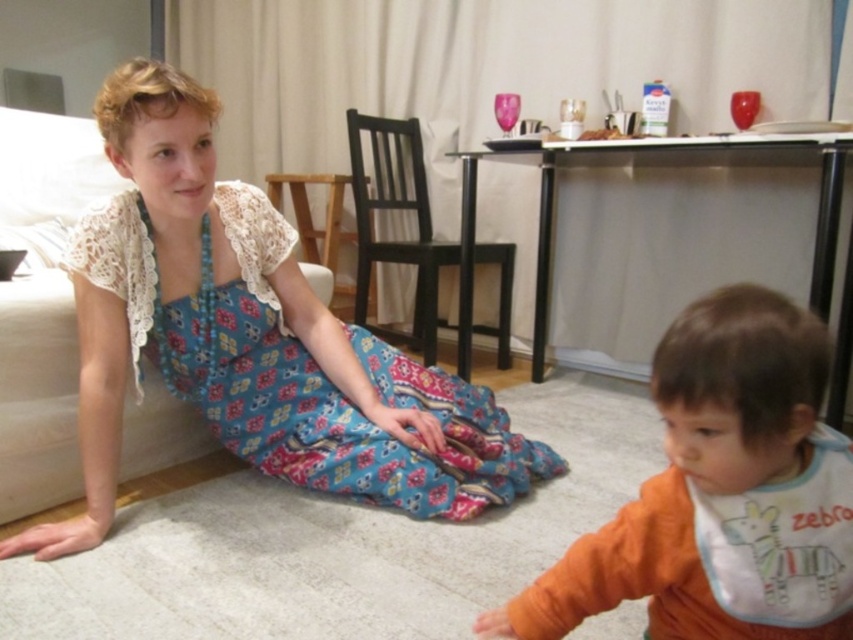
You are a tailor who needs to determine which item requires more fabric for alterations. Based on the scene, which item has a greater width between the blue printed fabric dress at lower left and the white fabric bib at lower right?

The blue printed fabric dress at lower left has a greater width than the white fabric bib at lower right, so it requires more fabric for alterations.

You are a parent preparing for a meal and need to choose between the orange fleece sweater at lower right and the white fabric bib at lower right for your child. Which item is more suitable for preventing food spills?

The white fabric bib at lower right is more suitable for preventing food spills because it is designed for that purpose, while the orange fleece sweater at lower right is larger in size but not intended for spill protection.

You are organizing a charity event and need to pack these two items into boxes. The orange fleece sweater at lower right and the blue printed fabric dress at lower left are both to be packed. If you have a box that can only fit items that take up less space than the other, which item should you place in the box first?

The orange fleece sweater at lower right should be placed in the box first because it occupies less space than the blue printed fabric dress at lower left, making it suitable for the box that requires items taking up less space.